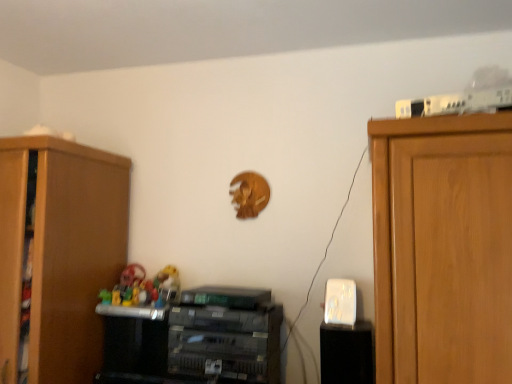
Question: Is wooden cabinet at left, the first cabinetry in the left-to-right sequence, further to the viewer compared to metallic gray printer at center, the 2th cabinetry in the left-to-right sequence?

Choices:
 (A) no
 (B) yes

Answer: (A)

Question: Is wooden cabinet at left, placed as the third cabinetry when sorted from right to left, positioned with its back to metallic gray printer at center, the 2th cabinetry in the left-to-right sequence?

Choices:
 (A) yes
 (B) no

Answer: (B)

Question: Is wooden cabinet at left, the first cabinetry in the left-to-right sequence, to the right of metallic gray printer at center, arranged as the 2th cabinetry when viewed from the right, from the viewer's perspective?

Choices:
 (A) yes
 (B) no

Answer: (B)

Question: Is wooden cabinet at left, placed as the third cabinetry when sorted from right to left, taller than metallic gray printer at center, arranged as the 2th cabinetry when viewed from the right?

Choices:
 (A) yes
 (B) no

Answer: (A)

Question: Considering the relative sizes of wooden cabinet at left, the first cabinetry in the left-to-right sequence, and metallic gray printer at center, the 2th cabinetry in the left-to-right sequence, in the image provided, is wooden cabinet at left, the first cabinetry in the left-to-right sequence, wider than metallic gray printer at center, the 2th cabinetry in the left-to-right sequence,?

Choices:
 (A) yes
 (B) no

Answer: (A)

Question: In terms of size, does wooden cabinet at left, placed as the third cabinetry when sorted from right to left, appear bigger or smaller than black plastic speaker at lower right, the 1th cabinetry when ordered from right to left?

Choices:
 (A) big
 (B) small

Answer: (A)

Question: Considering the relative positions of wooden cabinet at left, the first cabinetry in the left-to-right sequence, and black plastic speaker at lower right, which is counted as the third cabinetry, starting from the left, in the image provided, is wooden cabinet at left, the first cabinetry in the left-to-right sequence, to the left or to the right of black plastic speaker at lower right, which is counted as the third cabinetry, starting from the left,?

Choices:
 (A) left
 (B) right

Answer: (A)

Question: Considering the positions of point (53, 183) and point (339, 350), is point (53, 183) closer or farther from the camera than point (339, 350)?

Choices:
 (A) closer
 (B) farther

Answer: (B)

Question: Is wooden cabinet at left, placed as the third cabinetry when sorted from right to left, in front of or behind black plastic speaker at lower right, which is counted as the third cabinetry, starting from the left, in the image?

Choices:
 (A) front
 (B) behind

Answer: (A)

Question: From a real-world perspective, is black plastic speaker at lower right, which is counted as the third cabinetry, starting from the left, physically located above or below rubber toys at center?

Choices:
 (A) above
 (B) below

Answer: (B)

Question: Looking at their shapes, would you say black plastic speaker at lower right, the 1th cabinetry when ordered from right to left, is wider or thinner than rubber toys at center?

Choices:
 (A) thin
 (B) wide

Answer: (A)

Question: Is black plastic speaker at lower right, which is counted as the third cabinetry, starting from the left, to the left or to the right of rubber toys at center in the image?

Choices:
 (A) right
 (B) left

Answer: (A)

Question: Is black plastic speaker at lower right, the 1th cabinetry when ordered from right to left, inside or outside of rubber toys at center?

Choices:
 (A) outside
 (B) inside

Answer: (A)

Question: From a real-world perspective, is rubber toys at center physically located above or below metallic gray printer at center, the 2th cabinetry in the left-to-right sequence?

Choices:
 (A) below
 (B) above

Answer: (B)

Question: From the image's perspective, relative to metallic gray printer at center, arranged as the 2th cabinetry when viewed from the right, is rubber toys at center above or below?

Choices:
 (A) below
 (B) above

Answer: (B)